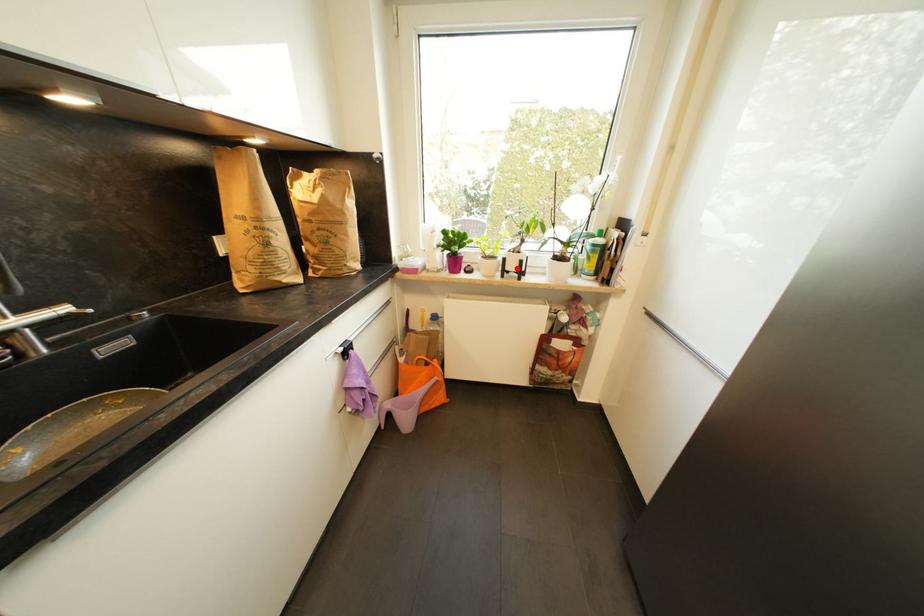
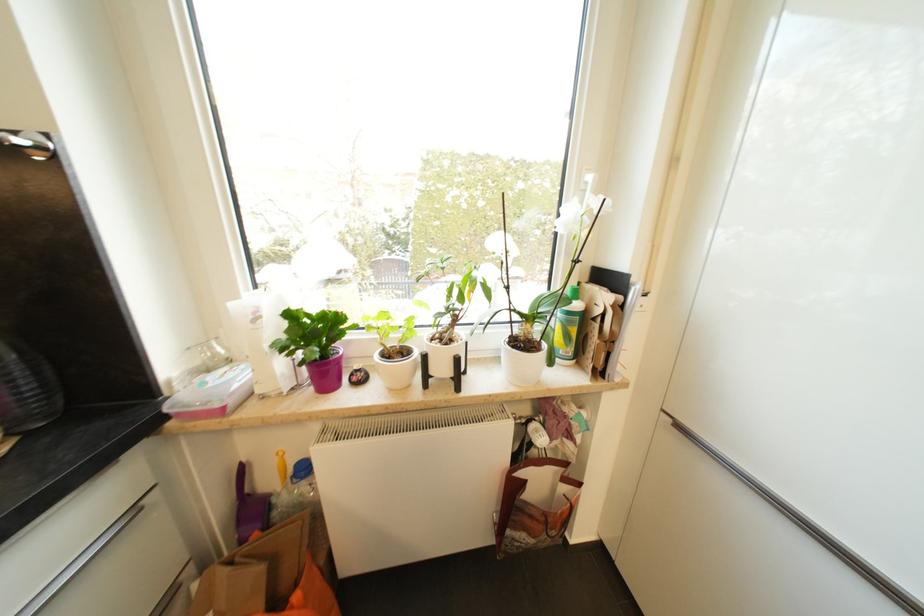
The point at the highlighted location is marked in the first image. Where is the corresponding point in the second image?

(446, 371)